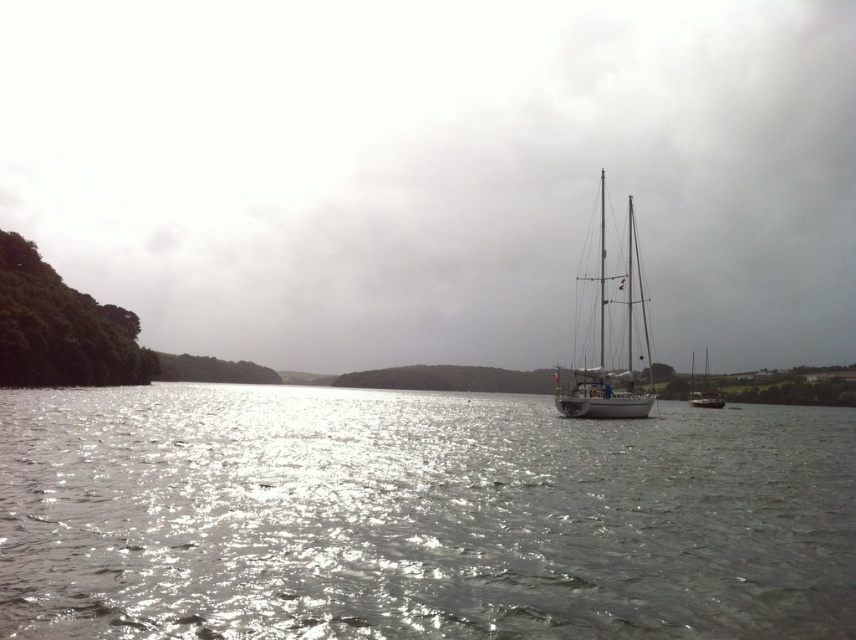
Question: Can you confirm if shiny metallic sailboat at center is positioned to the right of glistening silver water at center?

Choices:
 (A) no
 (B) yes

Answer: (A)

Question: Which point appears closest to the camera in this image?

Choices:
 (A) click(336, 550)
 (B) click(638, 298)
 (C) click(107, 6)
 (D) click(694, 384)

Answer: (A)

Question: Does shiny metallic sailboat at center appear under white glossy sailboat at center?

Choices:
 (A) yes
 (B) no

Answer: (B)

Question: Considering the real-world distances, which object is farthest from the shiny metallic sailboat at center?

Choices:
 (A) white matte sailboat at right
 (B) white glossy sailboat at center

Answer: (A)

Question: Does shiny metallic sailboat at center have a larger size compared to glistening silver water at center?

Choices:
 (A) no
 (B) yes

Answer: (B)

Question: Among these objects, which one is nearest to the camera?

Choices:
 (A) white matte sailboat at right
 (B) glistening silver water at center
 (C) white glossy sailboat at center

Answer: (B)